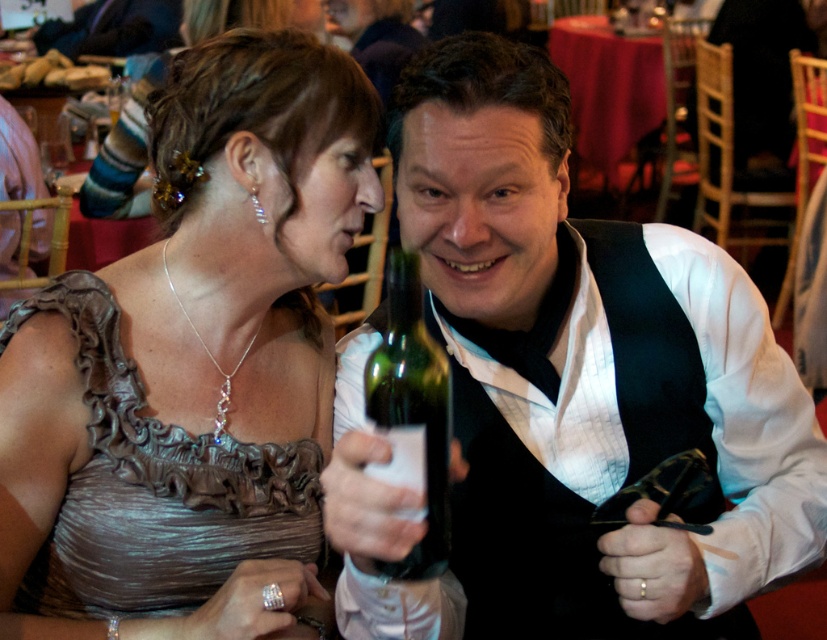
Does shiny silver dress at center lie behind green glass bottle at center?

That is True.

Who is shorter, shiny silver dress at center or green glass bottle at center?

Standing shorter between the two is green glass bottle at center.

Is point (354, 179) behind point (423, 413)?

Yes, it is behind point (423, 413).

This screenshot has height=640, width=827. Identify the location of shiny silver dress at center. (198, 348).

Which is below, matte green glass bottle at center or shiny silver dress at center?

matte green glass bottle at center is lower down.

The image size is (827, 640). Describe the element at coordinates (567, 387) in the screenshot. I see `matte green glass bottle at center` at that location.

Find the location of a particular element. matte green glass bottle at center is located at coordinates (567, 387).

Can you confirm if matte green glass bottle at center is wider than green glass bottle at center?

Indeed, matte green glass bottle at center has a greater width compared to green glass bottle at center.

Which is behind, point (749, 500) or point (409, 460)?

The point (749, 500) is behind.

Who is more distant from viewer, (572,484) or (405,436)?

Positioned behind is point (572,484).

Find the location of a particular element. This screenshot has height=640, width=827. matte green glass bottle at center is located at coordinates (567, 387).